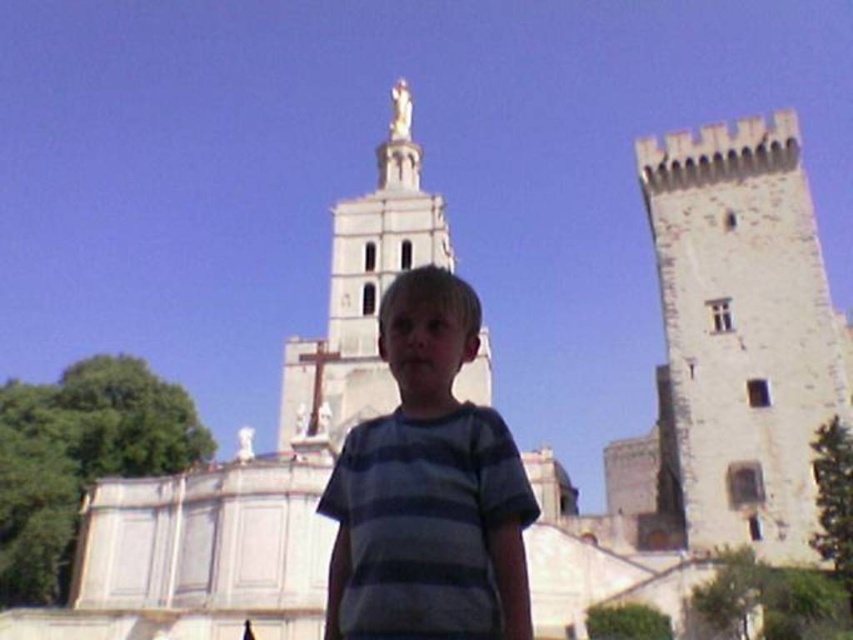
Where is `striped cotton shirt at center`? striped cotton shirt at center is located at coordinates (428, 488).

Consider the image. Does striped cotton shirt at center have a greater width compared to white stone tower at center?

No, striped cotton shirt at center is not wider than white stone tower at center.

Which is in front, point (490, 509) or point (352, 253)?

Point (490, 509) is more forward.

Image resolution: width=853 pixels, height=640 pixels. Find the location of `striped cotton shirt at center`. striped cotton shirt at center is located at coordinates (428, 488).